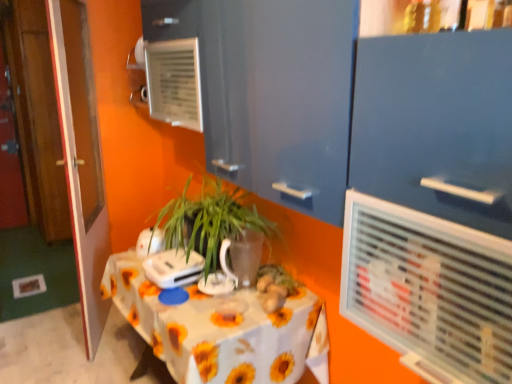
Question: From a real-world perspective, is wooden door at left positioned under white glossy kettle at upper center, placed as the 2th appliance when sorted from front to back, based on gravity?

Choices:
 (A) no
 (B) yes

Answer: (A)

Question: From the image's perspective, does wooden door at left appear lower than white glossy kettle at upper center, which is the first appliance in back-to-front order?

Choices:
 (A) yes
 (B) no

Answer: (B)

Question: Is wooden door at left completely or partially outside of white glossy kettle at upper center, which is the first appliance in back-to-front order?

Choices:
 (A) yes
 (B) no

Answer: (A)

Question: Is wooden door at left not close to white glossy kettle at upper center, which is the first appliance in back-to-front order?

Choices:
 (A) no
 (B) yes

Answer: (A)

Question: Does wooden door at left have a lesser height compared to white glossy kettle at upper center, which is the first appliance in back-to-front order?

Choices:
 (A) no
 (B) yes

Answer: (A)

Question: From a real-world perspective, is wooden door at left over white glossy kettle at upper center, placed as the 2th appliance when sorted from front to back?

Choices:
 (A) no
 (B) yes

Answer: (B)

Question: Does white plastic appliance at center, the 2th appliance viewed from the back, appear on the right side of white glossy table at center?

Choices:
 (A) no
 (B) yes

Answer: (A)

Question: Does white plastic appliance at center, arranged as the 1th appliance when viewed from the front, have a greater width compared to white glossy table at center?

Choices:
 (A) yes
 (B) no

Answer: (B)

Question: Can you confirm if white plastic appliance at center, arranged as the 1th appliance when viewed from the front, is thinner than white glossy table at center?

Choices:
 (A) no
 (B) yes

Answer: (B)

Question: From a real-world perspective, is white plastic appliance at center, arranged as the 1th appliance when viewed from the front, beneath white glossy table at center?

Choices:
 (A) no
 (B) yes

Answer: (A)

Question: Is white plastic appliance at center, the 2th appliance viewed from the back, positioned far away from white glossy table at center?

Choices:
 (A) yes
 (B) no

Answer: (B)

Question: Is white plastic appliance at center, arranged as the 1th appliance when viewed from the front, facing towards white glossy table at center?

Choices:
 (A) no
 (B) yes

Answer: (A)

Question: Considering the relative sizes of white glossy kettle at upper center, which is the first appliance in back-to-front order, and white plastic appliance at center, arranged as the 1th appliance when viewed from the front, in the image provided, is white glossy kettle at upper center, which is the first appliance in back-to-front order, thinner than white plastic appliance at center, arranged as the 1th appliance when viewed from the front,?

Choices:
 (A) yes
 (B) no

Answer: (A)